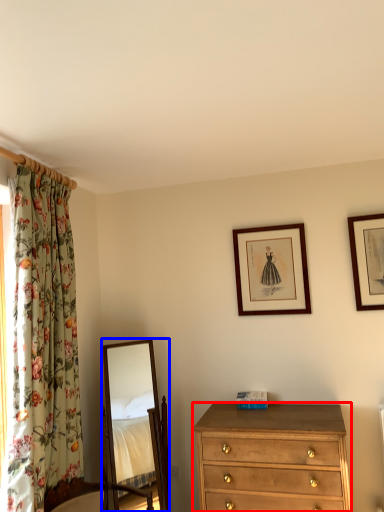
Question: Which of the following is the closest to the observer, chest of drawers (highlighted by a red box) or mirror (highlighted by a blue box)?

Choices:
 (A) chest of drawers
 (B) mirror

Answer: (A)